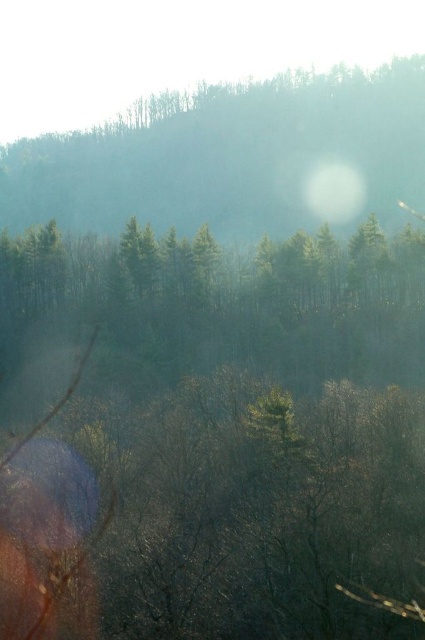
Is green matte trees at center behind green matte hillside at upper center?

That is False.

Does green matte trees at center have a smaller size compared to green matte hillside at upper center?

Indeed, green matte trees at center has a smaller size compared to green matte hillside at upper center.

Where is `green matte trees at center`? The width and height of the screenshot is (425, 640). green matte trees at center is located at coordinates (226, 300).

Is green matte hillside at upper center below white translucent fog at center?

No, green matte hillside at upper center is not below white translucent fog at center.

Is green matte hillside at upper center shorter than white translucent fog at center?

In fact, green matte hillside at upper center may be taller than white translucent fog at center.

Between point (0, 209) and point (353, 208), which one is positioned in front?

Point (353, 208) is in front.

Find the location of a particular element. green matte hillside at upper center is located at coordinates (232, 157).

Can you confirm if green matte trees at center is taller than white translucent fog at center?

Yes.

Is green matte trees at center further to camera compared to white translucent fog at center?

No.

Who is more distant from viewer, (x=214, y=304) or (x=345, y=205)?

The point (x=345, y=205) is behind.

I want to click on green matte trees at center, so coord(226,300).